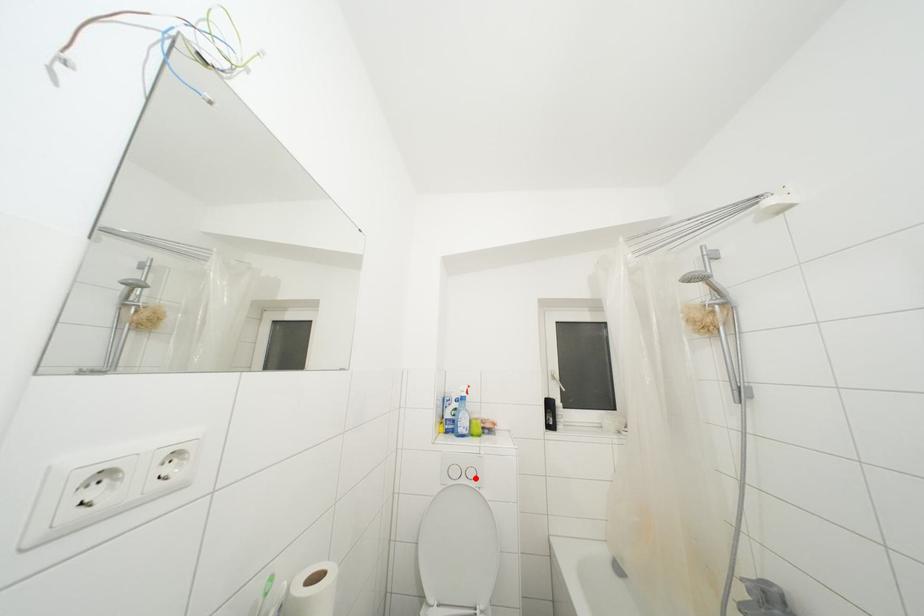
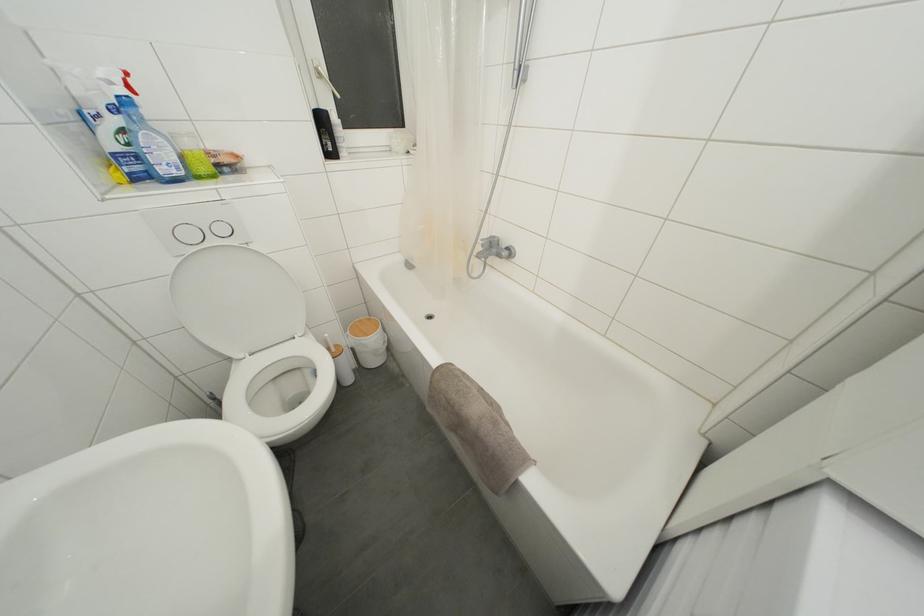
The point at the highlighted location is marked in the first image. Where is the corresponding point in the second image?

(226, 235)